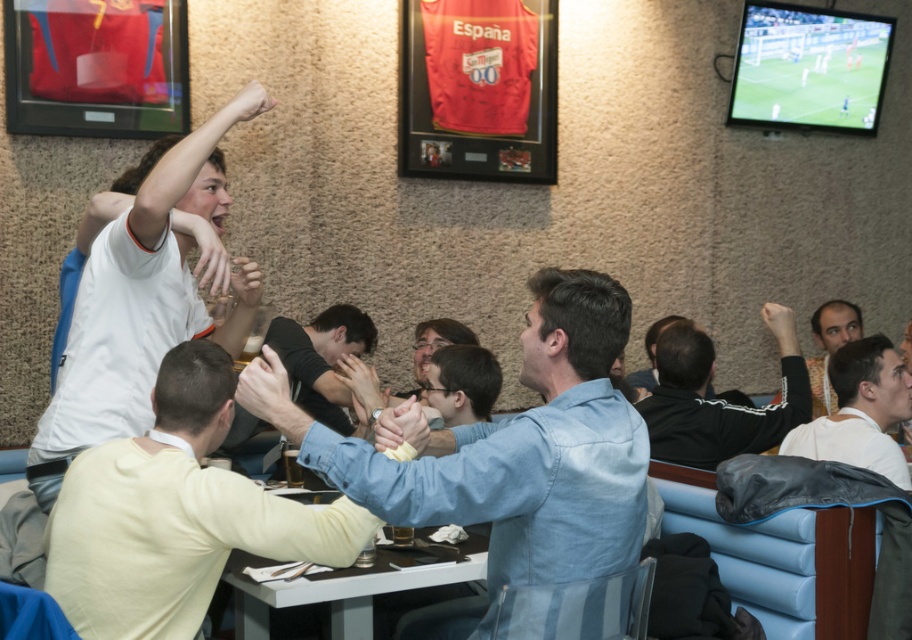
Can you confirm if light beige sweater at center is bigger than patterned fabric shirt at right?

Incorrect, light beige sweater at center is not larger than patterned fabric shirt at right.

Does point (798, 428) come in front of point (847, 337)?

That is True.

This screenshot has width=912, height=640. What are the coordinates of `light beige sweater at center` in the screenshot? It's located at (859, 412).

Is point (633, 532) positioned behind point (703, 336)?

No, (633, 532) is in front of (703, 336).

Can you confirm if denim shirt at center is positioned above black jersey at center?

No, denim shirt at center is not above black jersey at center.

Which is behind, point (581, 561) or point (732, 413)?

Point (732, 413)

The image size is (912, 640). In order to click on denim shirt at center in this screenshot , I will do `click(510, 448)`.

Is denim shirt at center taller than light beige sweater at center?

Indeed, denim shirt at center has a greater height compared to light beige sweater at center.

Is denim shirt at center below light beige sweater at center?

No.

Who is more distant from viewer, (283,422) or (832,385)?

The point (832,385) is behind.

This screenshot has height=640, width=912. Identify the location of denim shirt at center. (510, 448).